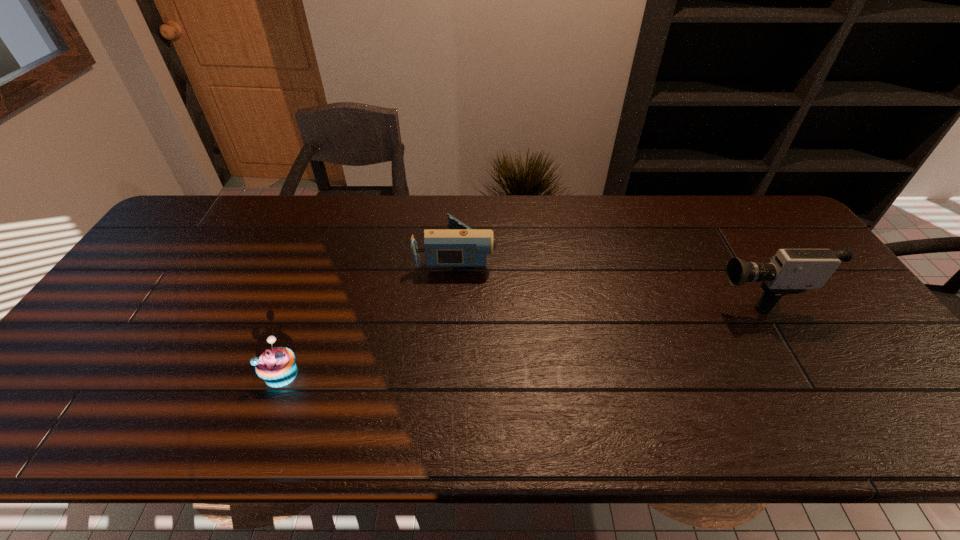
Identify the location of the right camcorder. The image size is (960, 540). (791, 271).

Locate an element on the screen. This screenshot has height=540, width=960. the tallest object is located at coordinates (791, 271).

You are a GUI agent. You are given a task and a screenshot of the screen. Output one action in this format:
    pyautogui.click(x=<x>, y=<y>)
    Task: Click on the left camcorder
    This screenshot has height=540, width=960.
    Given the screenshot: What is the action you would take?
    pyautogui.click(x=461, y=246)

You are a GUI agent. You are given a task and a screenshot of the screen. Output one action in this format:
    pyautogui.click(x=<x>, y=<y>)
    Task: Click on the second object from left to right
    
    Given the screenshot: What is the action you would take?
    pyautogui.click(x=461, y=246)

At what (x,y) coordinates should I click in order to perform the action: click on the shortest object. Please return your answer as a coordinate pair (x, y). This screenshot has width=960, height=540. Looking at the image, I should click on (276, 366).

This screenshot has height=540, width=960. Identify the location of the leftmost object. (276, 366).

In order to click on vacant space located on the recording direction of the tallest object in this screenshot , I will do `click(666, 293)`.

I want to click on vacant space situated 0.350m on the recording direction of the tallest object, so click(580, 293).

Locate an element on the screen. The image size is (960, 540). vacant space located on the recording direction of the tallest object is located at coordinates (652, 293).

I want to click on free space located 0.280m on the side of the second shortest object with the flip-out screen, so click(588, 253).